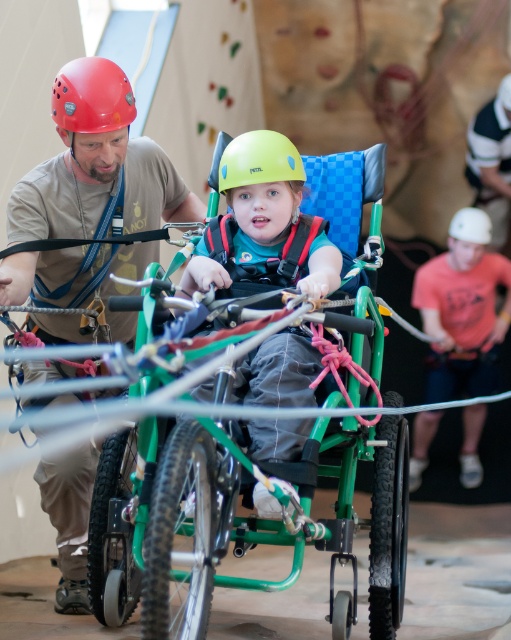
What is located at the point with coordinates (x=492, y=161) in the image?

The white fabric at upper right is located at point (x=492, y=161).

You are a safety inspector evaluating the climbing setup. You notice the matte red helmet at upper left and the white fabric at upper right. Which object is located to the left of the other?

The matte red helmet at upper left is positioned on the left side of white fabric at upper right.

You are observing the climbing scene and notice two helmets labeled matte red helmet at upper left and red matte helmet at upper left. Which helmet is taller?

The matte red helmet at upper left is taller than the red matte helmet at upper left.